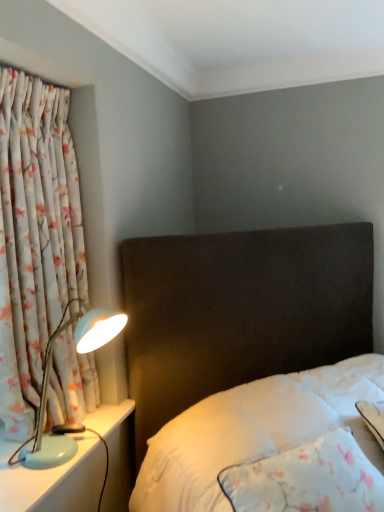
At what (x,y) coordinates should I click in order to perform the action: click on light blue plastic lamp at left. Please return your answer as a coordinate pair (x, y). This screenshot has height=512, width=384. Looking at the image, I should click on (47, 386).

Describe the element at coordinates (47, 386) in the screenshot. I see `light blue plastic lamp at left` at that location.

Where is `floral fabric curtain at left`? The height and width of the screenshot is (512, 384). floral fabric curtain at left is located at coordinates (35, 238).

This screenshot has height=512, width=384. Describe the element at coordinates (35, 238) in the screenshot. I see `floral fabric curtain at left` at that location.

Where is `light blue plastic lamp at left`? Image resolution: width=384 pixels, height=512 pixels. light blue plastic lamp at left is located at coordinates (47, 386).

Is floral fabric curtain at left to the left of light blue plastic lamp at left from the viewer's perspective?

Correct, you'll find floral fabric curtain at left to the left of light blue plastic lamp at left.

From the picture: Which object is more forward, floral fabric curtain at left or light blue plastic lamp at left?

floral fabric curtain at left is in front.

Does point (3, 157) appear closer or farther from the camera than point (43, 407)?

Point (3, 157).

From the image's perspective, is floral fabric curtain at left over light blue plastic lamp at left?

Yes, from the image's perspective, floral fabric curtain at left is above light blue plastic lamp at left.

From a real-world perspective, is floral fabric curtain at left under light blue plastic lamp at left?

No.

Considering the sizes of objects floral fabric curtain at left and light blue plastic lamp at left in the image provided, who is wider, floral fabric curtain at left or light blue plastic lamp at left?

light blue plastic lamp at left.

Between floral fabric curtain at left and light blue plastic lamp at left, which one has less height?

light blue plastic lamp at left is shorter.

Between floral fabric curtain at left and light blue plastic lamp at left, which one has smaller size?

With smaller size is light blue plastic lamp at left.

Can we say floral fabric curtain at left lies outside light blue plastic lamp at left?

floral fabric curtain at left is positioned outside light blue plastic lamp at left.

Is floral fabric curtain at left positioned far away from light blue plastic lamp at left?

floral fabric curtain at left is actually quite close to light blue plastic lamp at left.

Is floral fabric curtain at left positioned with its back to light blue plastic lamp at left?

A: Yes, floral fabric curtain at left is positioned with its back facing light blue plastic lamp at left.

What's the angular difference between floral fabric curtain at left and light blue plastic lamp at left's facing directions?

floral fabric curtain at left and light blue plastic lamp at left are facing 2.18 degrees away from each other.

Locate an element on the screen. This screenshot has height=512, width=384. lamp below the floral fabric curtain at left (from a real-world perspective) is located at coordinates (47, 386).

Is light blue plastic lamp at left to the right of floral fabric curtain at left from the viewer's perspective?

Yes, light blue plastic lamp at left is to the right of floral fabric curtain at left.

Between light blue plastic lamp at left and floral fabric curtain at left, which one is positioned behind?

light blue plastic lamp at left is behind.

Which is less distant, (114, 323) or (5, 161)?

Point (114, 323).

From the image's perspective, is light blue plastic lamp at left above floral fabric curtain at left?

No, from the image's perspective, light blue plastic lamp at left is not above floral fabric curtain at left.

From a real-world perspective, is light blue plastic lamp at left physically located above or below floral fabric curtain at left?

In terms of real-world spatial position, light blue plastic lamp at left is below floral fabric curtain at left.

Can you confirm if light blue plastic lamp at left is thinner than floral fabric curtain at left?

No.

From their relative heights in the image, would you say light blue plastic lamp at left is taller or shorter than floral fabric curtain at left?

In the image, light blue plastic lamp at left appears to be shorter than floral fabric curtain at left.

In the scene shown: Which of these two, light blue plastic lamp at left or floral fabric curtain at left, is smaller?

light blue plastic lamp at left.

Is floral fabric curtain at left inside light blue plastic lamp at left?

That's incorrect, floral fabric curtain at left is not inside light blue plastic lamp at left.

Is the surface of light blue plastic lamp at left in direct contact with floral fabric curtain at left?

No, light blue plastic lamp at left is not with floral fabric curtain at left.

Could you tell me if light blue plastic lamp at left is facing floral fabric curtain at left?

No, light blue plastic lamp at left is not facing towards floral fabric curtain at left.

How many degrees apart are the facing directions of light blue plastic lamp at left and floral fabric curtain at left?

The angular difference between light blue plastic lamp at left and floral fabric curtain at left is 2.18 degrees.

The width and height of the screenshot is (384, 512). I want to click on lamp below the floral fabric curtain at left (from a real-world perspective), so click(47, 386).

Locate an element on the screen. This screenshot has width=384, height=512. curtain that appears above the light blue plastic lamp at left (from the image's perspective) is located at coordinates (35, 238).

The height and width of the screenshot is (512, 384). Identify the location of lamp behind the floral fabric curtain at left. (47, 386).